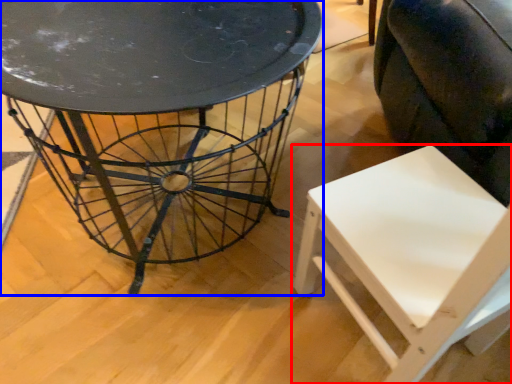
Question: Which point is further to the camera, chair (highlighted by a red box) or table (highlighted by a blue box)?

Choices:
 (A) chair
 (B) table

Answer: (B)